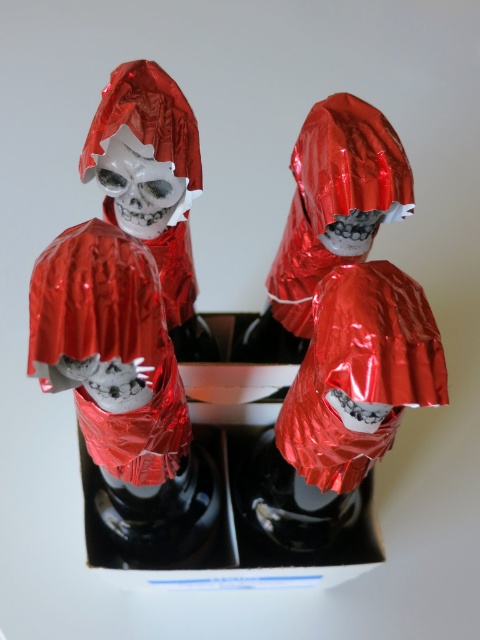
Can you confirm if metallic black box at center is positioned above shiny metallic skull at center?

Actually, metallic black box at center is below shiny metallic skull at center.

Does metallic black box at center have a lesser width compared to shiny metallic skull at center?

Incorrect, metallic black box at center's width is not less than shiny metallic skull at center's.

Between point (298, 509) and point (118, 221), which one is positioned behind?

Positioned behind is point (298, 509).

Locate an element on the screen. The width and height of the screenshot is (480, 640). metallic black box at center is located at coordinates (228, 506).